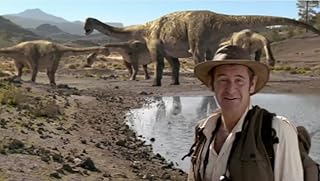
Find the location of a particular element. The height and width of the screenshot is (181, 320). chest is located at coordinates (219, 142).